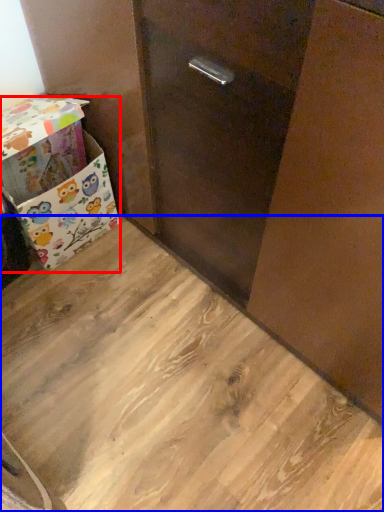
Question: Which point is closer to the camera, box (highlighted by a red box) or plywood (highlighted by a blue box)?

Choices:
 (A) box
 (B) plywood

Answer: (B)